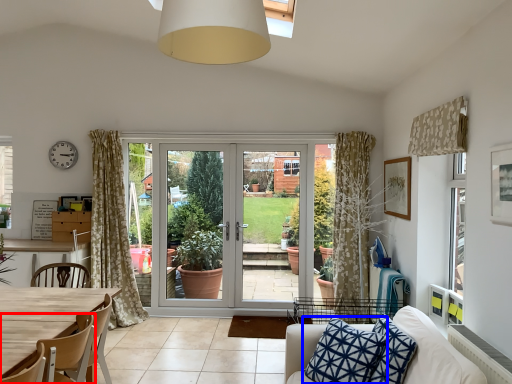
Question: Which point is further to the camera, chair (highlighted by a red box) or pillow (highlighted by a blue box)?

Choices:
 (A) chair
 (B) pillow

Answer: (B)